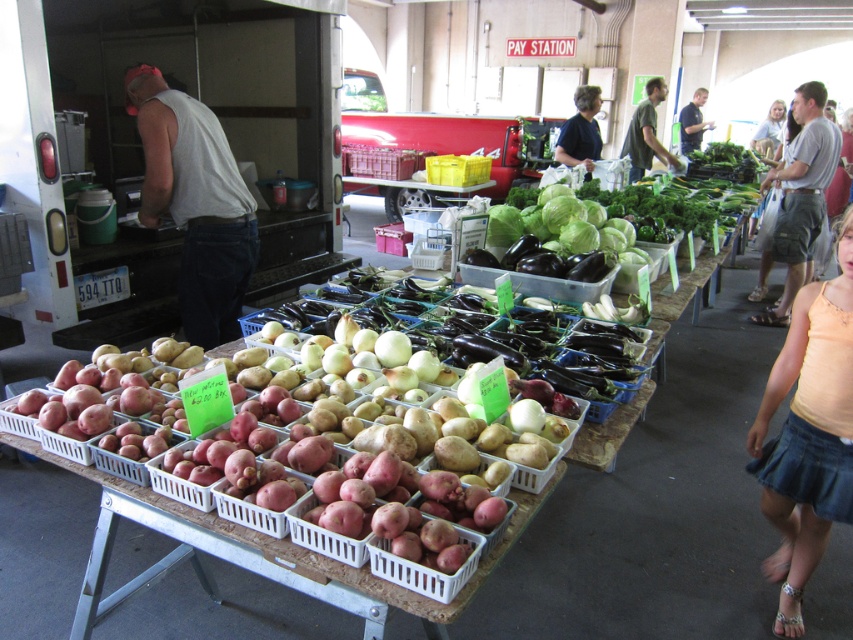
You are a customer at the market and see two shirts hanging on a rack between the vegetable crates. The white tank top at center and the dark blue shirt at center. Which one is closer to the ground?

The white tank top at center is below the dark blue shirt at center, so it is closer to the ground.